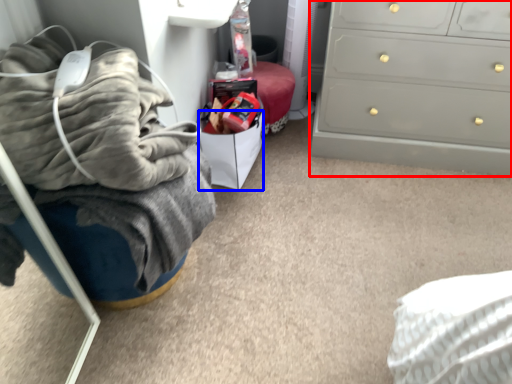
Question: Which object appears closest to the camera in this image, chest of drawers (highlighted by a red box) or drawer (highlighted by a blue box)?

Choices:
 (A) chest of drawers
 (B) drawer

Answer: (A)